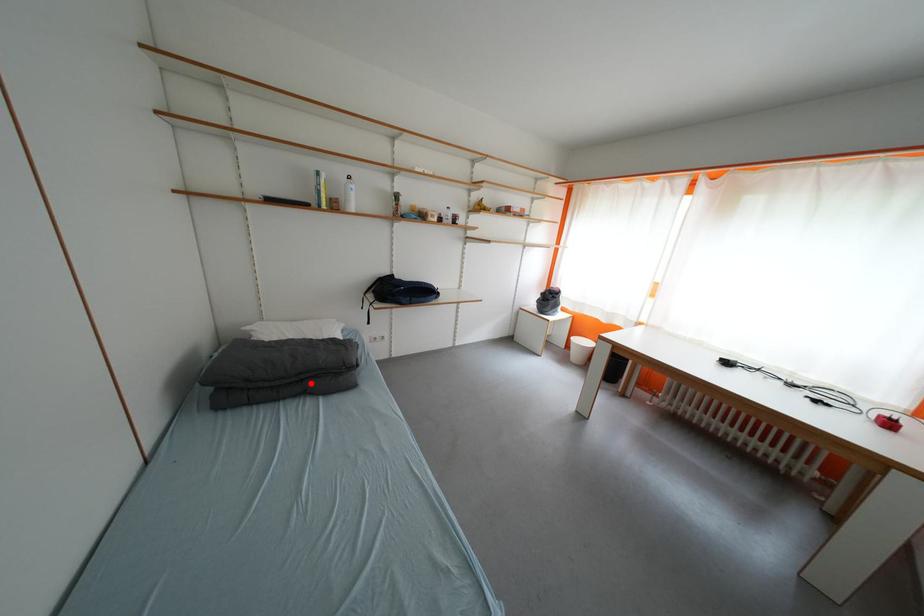
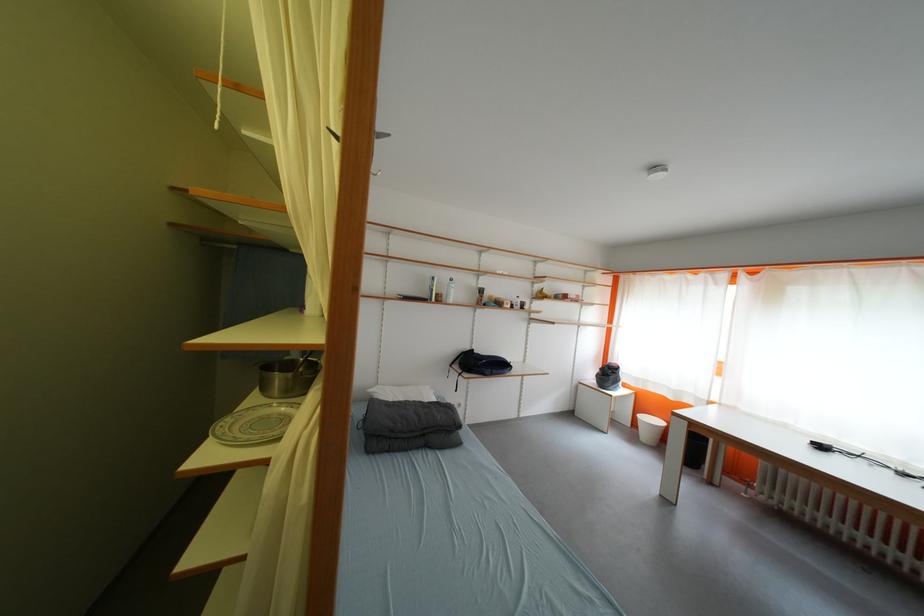
Find the pixel in the second image that matches the highlighted location in the first image.

(432, 438)